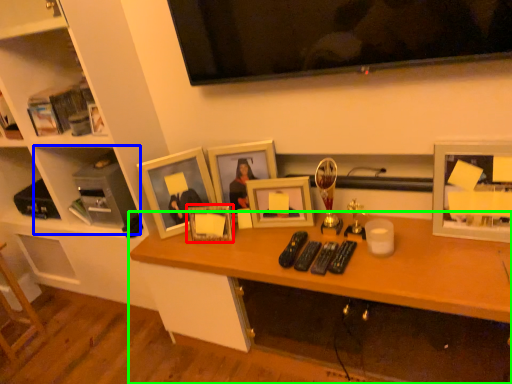
Question: Considering the real-world distances, which object is closest to picture frame (highlighted by a red box)? cabinet (highlighted by a blue box) or desk (highlighted by a green box).

Choices:
 (A) cabinet
 (B) desk

Answer: (B)